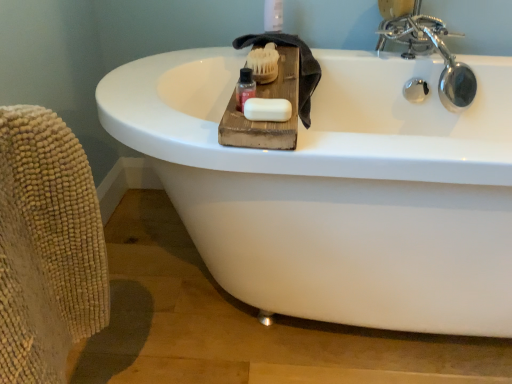
The height and width of the screenshot is (384, 512). Describe the element at coordinates (430, 52) in the screenshot. I see `chrome metallic faucet at upper right` at that location.

You are a GUI agent. You are given a task and a screenshot of the screen. Output one action in this format:
    pyautogui.click(x=<x>, y=<y>)
    Task: Click on the chrome metallic faucet at upper right
    
    Given the screenshot: What is the action you would take?
    pyautogui.click(x=430, y=52)

From the image's perspective, is translucent plastic bottle at upper center located above or below white matte soap at center?

Clearly, from the image's perspective, translucent plastic bottle at upper center is above white matte soap at center.

Based on the photo, is translucent plastic bottle at upper center looking in the opposite direction of white matte soap at center?

No, translucent plastic bottle at upper center is not facing away from white matte soap at center.

Can you tell me how much translucent plastic bottle at upper center and white matte soap at center differ in facing direction?

0.00416 degrees separate the facing orientations of translucent plastic bottle at upper center and white matte soap at center.

Which point is more distant from viewer, (x=244, y=77) or (x=260, y=117)?

Point (x=244, y=77)

Is chrome metallic faucet at upper right oriented towards white matte soap at center?

No.

Which is in front, point (421, 86) or point (276, 111)?

The point (276, 111) is closer to the camera.

Between chrome metallic faucet at upper right and white matte soap at center, which one has larger width?

Wider between the two is chrome metallic faucet at upper right.

Is chrome metallic faucet at upper right not inside white matte soap at center?

Yes, chrome metallic faucet at upper right is outside of white matte soap at center.

Is translucent plastic bottle at upper center oriented away from beige textured armchair at left?

No, beige textured armchair at left is not at the back of translucent plastic bottle at upper center.

Does translucent plastic bottle at upper center have a greater height compared to beige textured armchair at left?

No, translucent plastic bottle at upper center is not taller than beige textured armchair at left.

Do you think translucent plastic bottle at upper center is within beige textured armchair at left, or outside of it?

The correct answer is: outside.

Considering the sizes of translucent plastic bottle at upper center and beige textured armchair at left in the image, is translucent plastic bottle at upper center wider or thinner than beige textured armchair at left?

Considering their sizes, translucent plastic bottle at upper center looks slimmer than beige textured armchair at left.

How many degrees apart are the facing directions of chrome metallic faucet at upper right and beige textured armchair at left?

chrome metallic faucet at upper right and beige textured armchair at left are facing 89 degrees away from each other.

Relative to beige textured armchair at left, is chrome metallic faucet at upper right in front or behind?

Visually, chrome metallic faucet at upper right is located behind beige textured armchair at left.

Consider the image. Which object is wider, chrome metallic faucet at upper right or beige textured armchair at left?

chrome metallic faucet at upper right.

Between translucent plastic bottle at upper center and chrome metallic faucet at upper right, which one appears on the right side from the viewer's perspective?

From the viewer's perspective, chrome metallic faucet at upper right appears more on the right side.

Is the position of translucent plastic bottle at upper center more distant than that of chrome metallic faucet at upper right?

No, translucent plastic bottle at upper center is closer to the viewer.

Does translucent plastic bottle at upper center turn towards chrome metallic faucet at upper right?

No, translucent plastic bottle at upper center is not facing towards chrome metallic faucet at upper right.

I want to click on mouthwash on the left of the chrome metallic faucet at upper right, so click(x=245, y=88).

Between chrome metallic faucet at upper right and translucent plastic bottle at upper center, which one has larger width?

Wider between the two is chrome metallic faucet at upper right.

Is chrome metallic faucet at upper right inside the boundaries of translucent plastic bottle at upper center, or outside?

chrome metallic faucet at upper right is located beyond the bounds of translucent plastic bottle at upper center.

From the image's perspective, is chrome metallic faucet at upper right below translucent plastic bottle at upper center?

Actually, chrome metallic faucet at upper right appears above translucent plastic bottle at upper center in the image.

What's the angular difference between chrome metallic faucet at upper right and translucent plastic bottle at upper center's facing directions?

The angle between the facing direction of chrome metallic faucet at upper right and the facing direction of translucent plastic bottle at upper center is 3.27 degrees.

From a real-world perspective, is dark gray textured towel at upper center located higher than beige textured armchair at left?

Yes, from a real-world perspective, dark gray textured towel at upper center is over beige textured armchair at left

Considering the positions of objects dark gray textured towel at upper center and beige textured armchair at left in the image provided, who is more to the right, dark gray textured towel at upper center or beige textured armchair at left?

dark gray textured towel at upper center.

How different are the orientations of dark gray textured towel at upper center and beige textured armchair at left in degrees?

90.3 degrees separate the facing orientations of dark gray textured towel at upper center and beige textured armchair at left.

Where is `mouthwash that appears above the white matte soap at center (from a real-world perspective)`? This screenshot has width=512, height=384. mouthwash that appears above the white matte soap at center (from a real-world perspective) is located at coordinates (245, 88).

In order to click on tap behind the white matte soap at center in this screenshot , I will do `click(430, 52)`.

Based on their spatial positions, is beige textured armchair at left or translucent plastic bottle at upper center closer to white matte soap at center?

translucent plastic bottle at upper center lies closer to white matte soap at center than the other object.

Which object lies nearer to the anchor point translucent plastic bottle at upper center, beige textured armchair at left or white matte soap at center?

Among the two, white matte soap at center is located nearer to translucent plastic bottle at upper center.

From the picture: From the image, which object appears to be farther from chrome metallic faucet at upper right, white matte soap at center or translucent plastic bottle at upper center?

The object further to chrome metallic faucet at upper right is white matte soap at center.

Estimate the real-world distances between objects in this image. Which object is closer to dark gray textured towel at upper center, beige textured armchair at left or chrome metallic faucet at upper right?

chrome metallic faucet at upper right.

Estimate the real-world distances between objects in this image. Which object is further from chrome metallic faucet at upper right, beige textured armchair at left or dark gray textured towel at upper center?

beige textured armchair at left is positioned further to the anchor chrome metallic faucet at upper right.

Which object lies nearer to the anchor point chrome metallic faucet at upper right, beige textured armchair at left or translucent plastic bottle at upper center?

translucent plastic bottle at upper center is positioned closer to the anchor chrome metallic faucet at upper right.

From the image, which object appears to be nearer to dark gray textured towel at upper center, white matte soap at center or translucent plastic bottle at upper center?

Based on the image, translucent plastic bottle at upper center appears to be nearer to dark gray textured towel at upper center.

When comparing their distances from dark gray textured towel at upper center, does translucent plastic bottle at upper center or beige textured armchair at left seem further?

beige textured armchair at left.

You are a GUI agent. You are given a task and a screenshot of the screen. Output one action in this format:
    pyautogui.click(x=<x>, y=<y>)
    Task: Click on the soap between beige textured armchair at left and chrome metallic faucet at upper right
    
    Given the screenshot: What is the action you would take?
    pyautogui.click(x=267, y=109)

Locate an element on the screen. The width and height of the screenshot is (512, 384). soap between beige textured armchair at left and translucent plastic bottle at upper center from front to back is located at coordinates (267, 109).

Locate an element on the screen. soap between beige textured armchair at left and dark gray textured towel at upper center in the front-back direction is located at coordinates (267, 109).

Where is `soap situated between translucent plastic bottle at upper center and chrome metallic faucet at upper right from left to right`? The image size is (512, 384). soap situated between translucent plastic bottle at upper center and chrome metallic faucet at upper right from left to right is located at coordinates (267, 109).